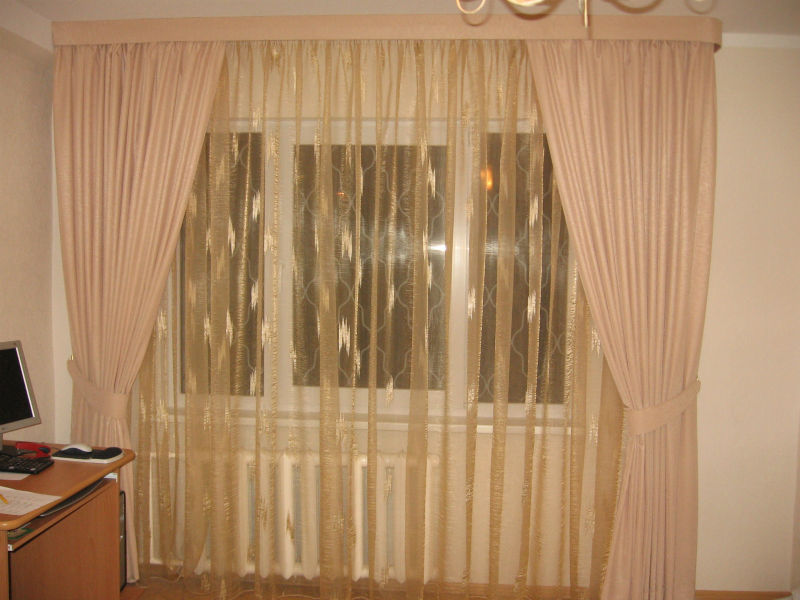
Identify the location of beige sash holding drapes. The image size is (800, 600). (658, 406), (102, 394).